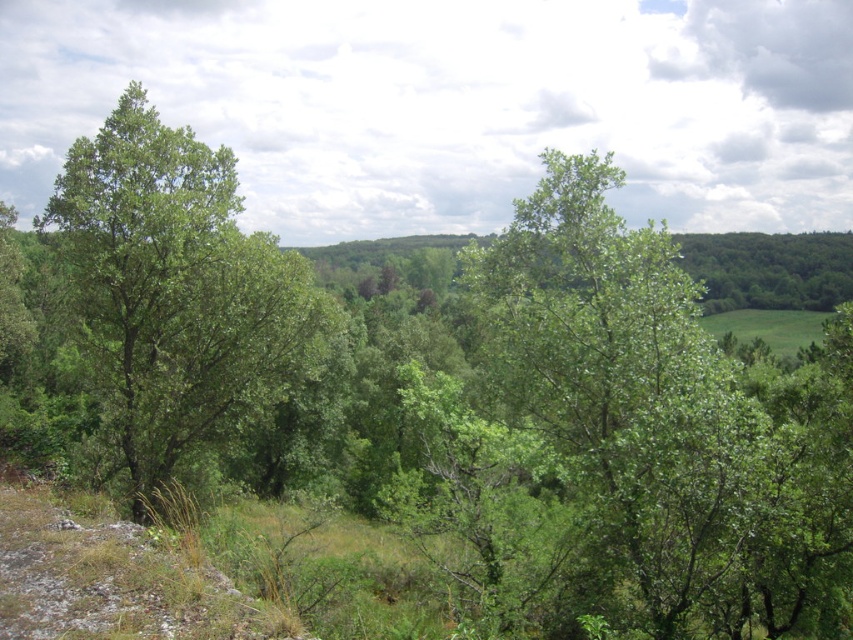
Question: Which object is closer to the camera taking this photo?

Choices:
 (A) green leafy tree at center
 (B) green leafy tree at left

Answer: (A)

Question: Does green leafy tree at center appear on the left side of green leafy tree at left?

Choices:
 (A) yes
 (B) no

Answer: (B)

Question: In this image, where is green leafy tree at center located relative to green leafy tree at left?

Choices:
 (A) above
 (B) below

Answer: (B)

Question: Does green leafy tree at center appear on the left side of green leafy tree at left?

Choices:
 (A) no
 (B) yes

Answer: (A)